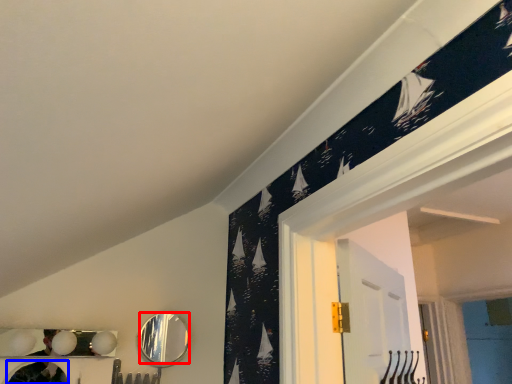
Question: Which object is further to the camera taking this photo, mirror (highlighted by a red box) or mirror (highlighted by a blue box)?

Choices:
 (A) mirror
 (B) mirror

Answer: (A)